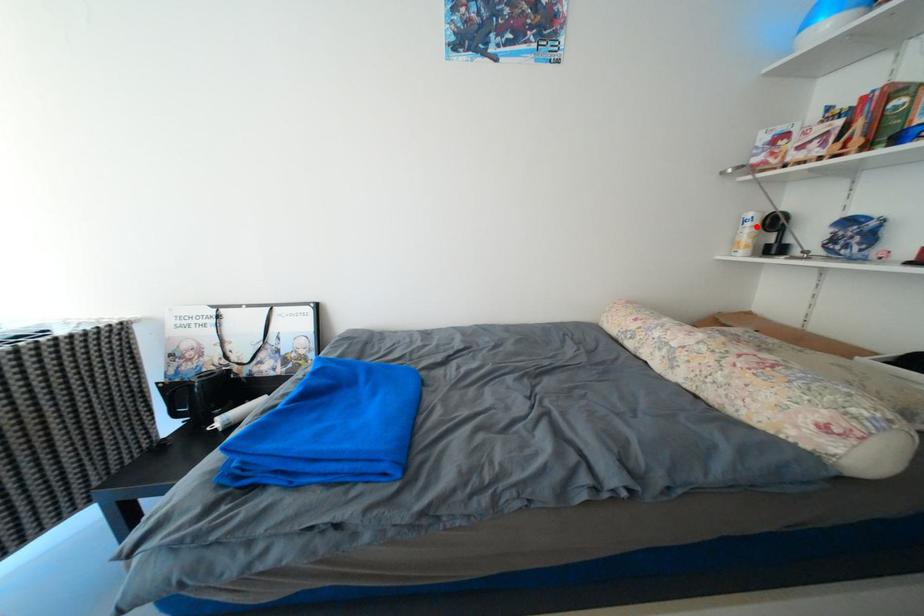
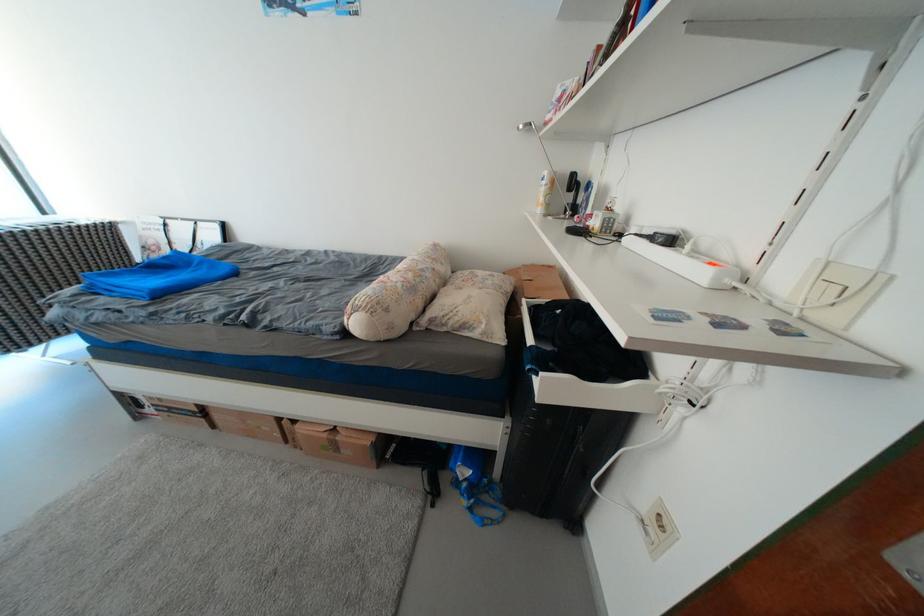
Find the pixel in the second image that matches the highlighted location in the first image.

(553, 185)